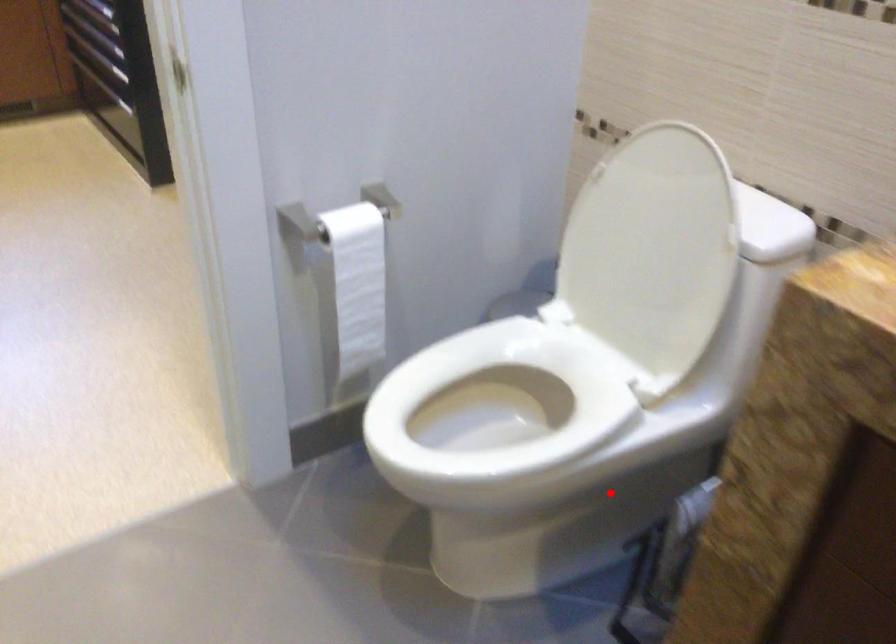
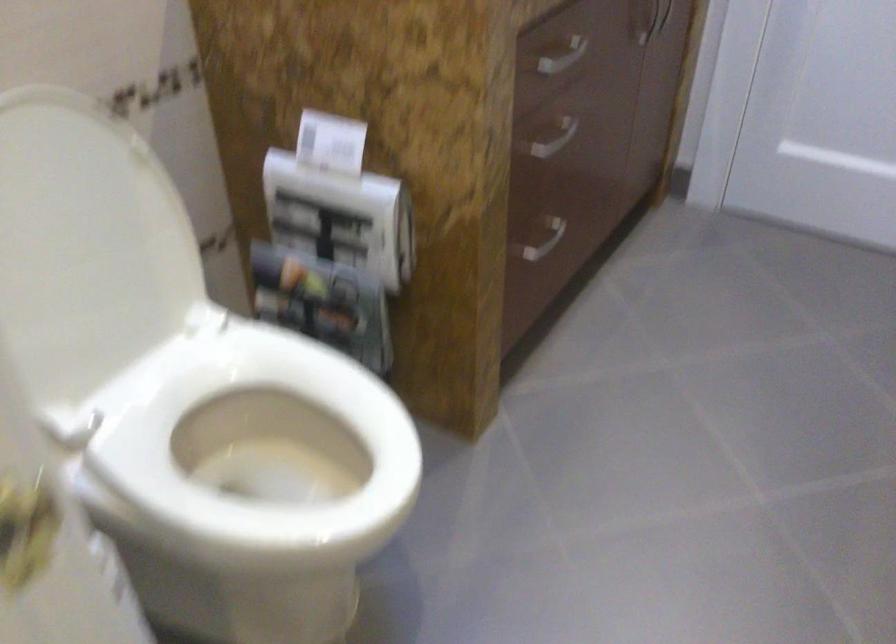
In the second image, find the point that corresponds to the highlighted location in the first image.

(257, 438)